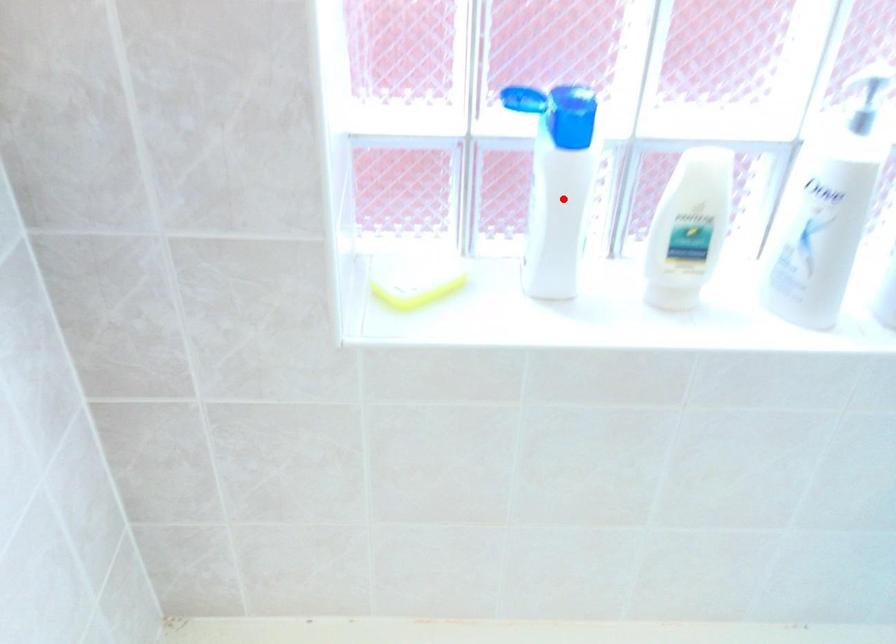
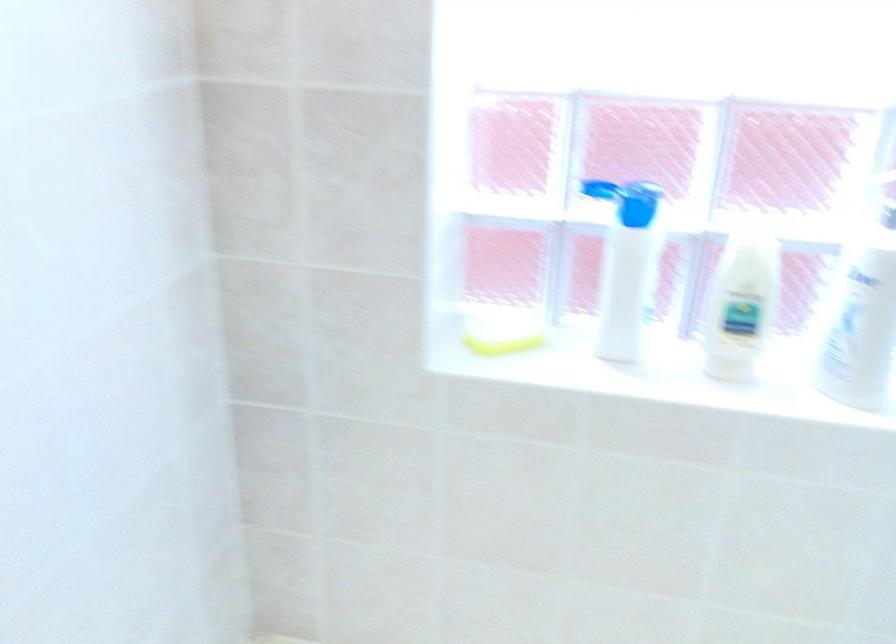
Question: I am providing you with two images of the same scene from different viewpoints. A red point is shown in image1. For the corresponding object point in image2, is it positioned nearer or farther from the camera?

Choices:
 (A) Nearer
 (B) Farther

Answer: (B)